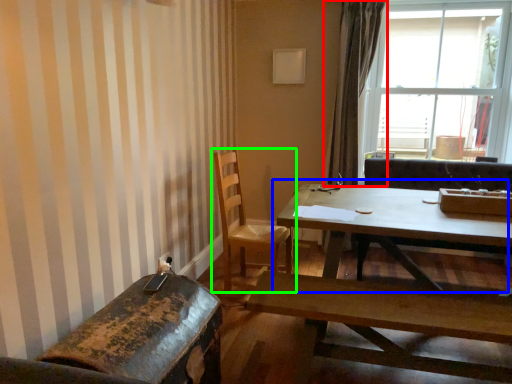
Question: Considering the real-world distances, which object is farthest from curtain (highlighted by a red box)? coffee table (highlighted by a blue box) or chair (highlighted by a green box)?

Choices:
 (A) coffee table
 (B) chair

Answer: (B)